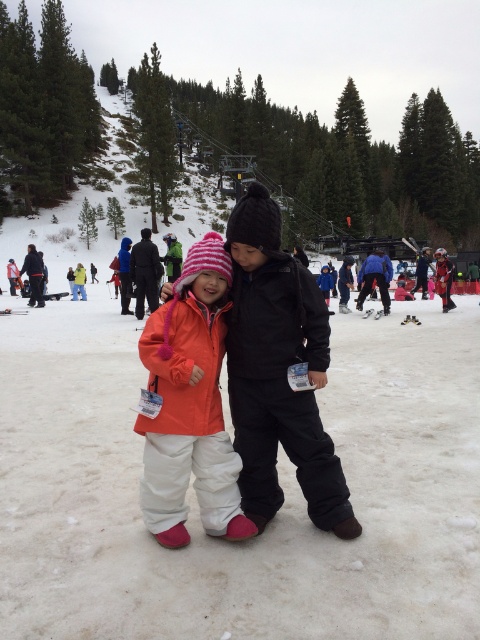
Question: Can you confirm if orange softshell jacket at center is bigger than orange fleece jacket at center?

Choices:
 (A) yes
 (B) no

Answer: (B)

Question: Where is black matte jacket at center located in relation to orange fleece jacket at center in the image?

Choices:
 (A) right
 (B) left

Answer: (A)

Question: Which point is farther from the camera taking this photo?

Choices:
 (A) (152, 284)
 (B) (196, 451)

Answer: (A)

Question: Which object is the closest to the black matte jacket at center?

Choices:
 (A) orange fleece jacket at center
 (B) orange softshell jacket at center

Answer: (B)

Question: Which point is closer to the camera?

Choices:
 (A) black matte jacket at center
 (B) orange softshell jacket at center

Answer: (B)

Question: Is orange softshell jacket at center positioned in front of orange fleece jacket at center?

Choices:
 (A) yes
 (B) no

Answer: (A)